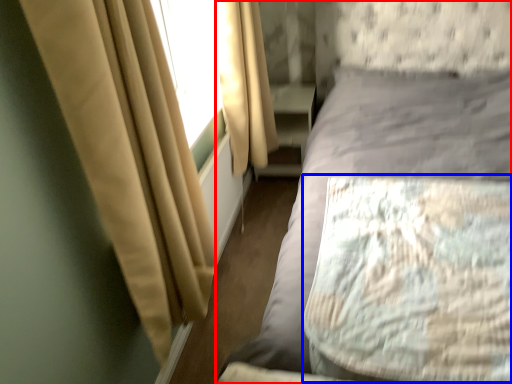
Question: Which point is further to the camera, bed (highlighted by a red box) or mattress (highlighted by a blue box)?

Choices:
 (A) bed
 (B) mattress

Answer: (B)